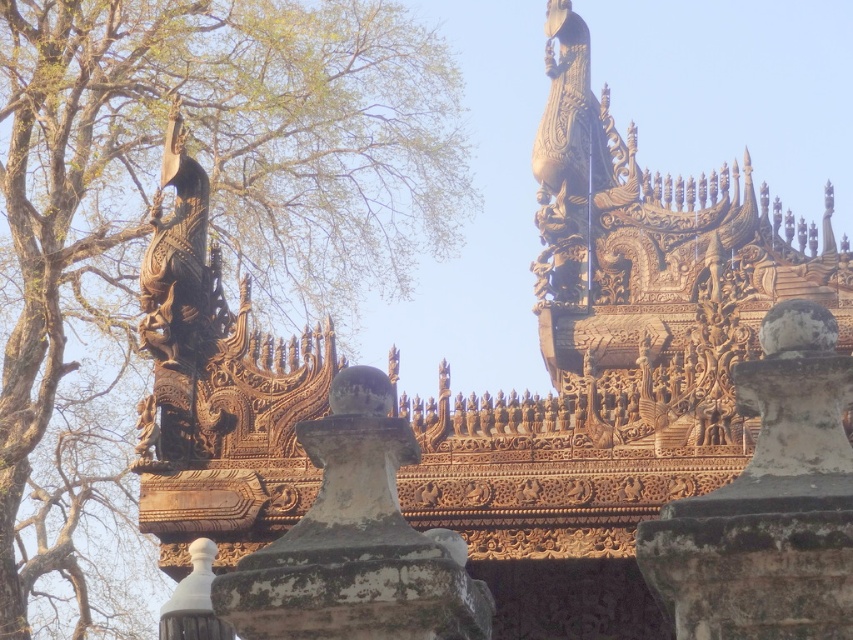
Question: Which point is closer to the camera?

Choices:
 (A) (357, 595)
 (B) (733, 621)
 (C) (329, 81)

Answer: (B)

Question: Does green leafy tree at upper left have a greater width compared to white stone pillar at center?

Choices:
 (A) yes
 (B) no

Answer: (A)

Question: In this image, where is green leafy tree at upper left located relative to stone/rough pillar at center?

Choices:
 (A) left
 (B) right

Answer: (A)

Question: Which of the following is the closest to the observer?

Choices:
 (A) white stone pillar at center
 (B) stone/rough pillar at center
 (C) green leafy tree at upper left

Answer: (A)

Question: Which is nearer to the stone/rough pillar at center?

Choices:
 (A) green leafy tree at upper left
 (B) white stone pillar at center

Answer: (B)

Question: From the image, what is the correct spatial relationship of green leafy tree at upper left in relation to white stone pillar at center?

Choices:
 (A) right
 (B) left

Answer: (B)